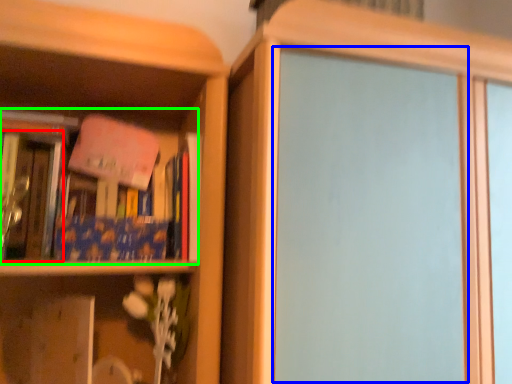
Question: Based on their relative distances, which object is nearer to book (highlighted by a red box)? Choose from screen door (highlighted by a blue box) and book (highlighted by a green box).

Choices:
 (A) screen door
 (B) book

Answer: (B)